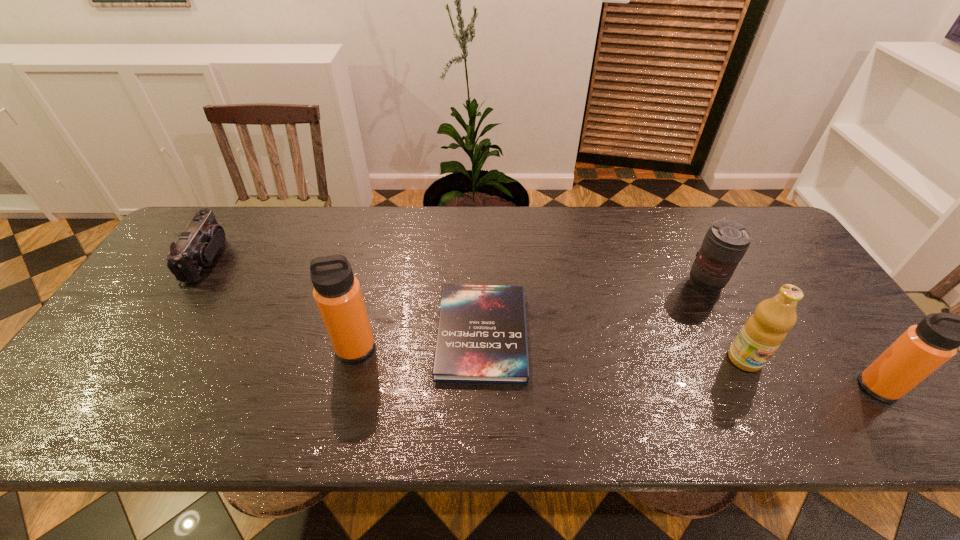
The width and height of the screenshot is (960, 540). Find the location of `free space located 0.050m on the back of the left thermos bottle`. free space located 0.050m on the back of the left thermos bottle is located at coordinates (363, 317).

The width and height of the screenshot is (960, 540). In order to click on vacant space located 0.260m on the back of the shorter thermos bottle in this screenshot , I will do `click(809, 292)`.

Find the location of a particular element. The image size is (960, 540). vacant region located on the front-facing side of the camcorder is located at coordinates 354,258.

The height and width of the screenshot is (540, 960). I want to click on blank space located on the side of the telephoto lens where the control switches are located, so click(x=730, y=332).

At what (x,y) coordinates should I click in order to perform the action: click on vacant region located 0.090m on the back of the third object from left to right. Please return your answer as a coordinate pair (x, y). The height and width of the screenshot is (540, 960). Looking at the image, I should click on (482, 269).

Locate an element on the screen. This screenshot has width=960, height=540. free space located 0.060m on the label of the olive oil is located at coordinates (763, 396).

At what (x,y) coordinates should I click in order to perform the action: click on object located in the far edge section of the desktop. Please return your answer as a coordinate pair (x, y). This screenshot has height=540, width=960. Looking at the image, I should click on (197, 245).

Image resolution: width=960 pixels, height=540 pixels. What are the coordinates of `thermos bottle that is at the near edge` in the screenshot? It's located at (922, 349).

Image resolution: width=960 pixels, height=540 pixels. Find the location of `hardback book at the near edge`. hardback book at the near edge is located at coordinates (482, 337).

Where is `olive oil present at the near edge`? The width and height of the screenshot is (960, 540). olive oil present at the near edge is located at coordinates (764, 331).